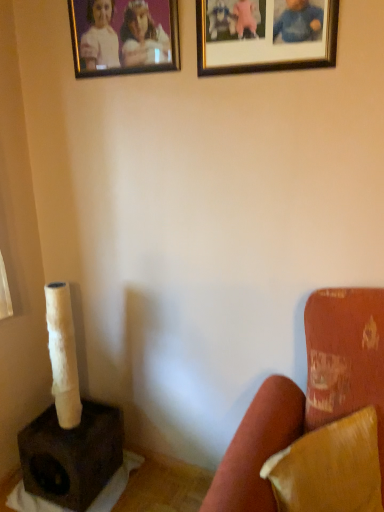
Question: Is dark brown matte speaker at lower left in contact with gold-framed picture at upper center, the 2th picture frame when ordered from left to right?

Choices:
 (A) no
 (B) yes

Answer: (A)

Question: Is dark brown matte speaker at lower left smaller than gold-framed picture at upper center, acting as the first picture frame starting from the right?

Choices:
 (A) no
 (B) yes

Answer: (A)

Question: From a real-world perspective, is dark brown matte speaker at lower left positioned over gold-framed picture at upper center, acting as the first picture frame starting from the right, based on gravity?

Choices:
 (A) yes
 (B) no

Answer: (B)

Question: From a real-world perspective, is dark brown matte speaker at lower left under gold-framed picture at upper center, the 2th picture frame when ordered from left to right?

Choices:
 (A) no
 (B) yes

Answer: (B)

Question: Is gold-framed picture at upper center, acting as the first picture frame starting from the right, located within dark brown matte speaker at lower left?

Choices:
 (A) yes
 (B) no

Answer: (B)

Question: Relative to gold-framed picture at upper center, the 2th picture frame when ordered from left to right, is gold-framed photo at upper center, which ranks as the first picture frame in left-to-right order, in front or behind?

Choices:
 (A) front
 (B) behind

Answer: (B)

Question: Considering the positions of point (137, 70) and point (249, 49), is point (137, 70) closer or farther from the camera than point (249, 49)?

Choices:
 (A) farther
 (B) closer

Answer: (A)

Question: Considering the positions of gold-framed photo at upper center, which ranks as the first picture frame in left-to-right order, and gold-framed picture at upper center, the 2th picture frame when ordered from left to right, in the image, is gold-framed photo at upper center, which ranks as the first picture frame in left-to-right order, bigger or smaller than gold-framed picture at upper center, the 2th picture frame when ordered from left to right,?

Choices:
 (A) small
 (B) big

Answer: (B)

Question: From the image's perspective, is gold-framed photo at upper center, which ranks as the first picture frame in left-to-right order, above or below gold-framed picture at upper center, acting as the first picture frame starting from the right?

Choices:
 (A) above
 (B) below

Answer: (A)

Question: Is gold-framed picture at upper center, acting as the first picture frame starting from the right, in front of or behind gold-framed photo at upper center, the second picture frame in the right-to-left sequence, in the image?

Choices:
 (A) behind
 (B) front

Answer: (B)

Question: Considering the positions of point (258, 23) and point (129, 42), is point (258, 23) closer or farther from the camera than point (129, 42)?

Choices:
 (A) farther
 (B) closer

Answer: (B)

Question: Would you say gold-framed picture at upper center, the 2th picture frame when ordered from left to right, is inside or outside gold-framed photo at upper center, the second picture frame in the right-to-left sequence?

Choices:
 (A) outside
 (B) inside

Answer: (A)

Question: Is gold-framed picture at upper center, the 2th picture frame when ordered from left to right, wider or thinner than gold-framed photo at upper center, the second picture frame in the right-to-left sequence?

Choices:
 (A) wide
 (B) thin

Answer: (B)

Question: Is gold-framed photo at upper center, the second picture frame in the right-to-left sequence, in front of or behind velvet red armchair at lower right in the image?

Choices:
 (A) front
 (B) behind

Answer: (B)

Question: Considering the positions of gold-framed photo at upper center, the second picture frame in the right-to-left sequence, and velvet red armchair at lower right in the image, is gold-framed photo at upper center, the second picture frame in the right-to-left sequence, wider or thinner than velvet red armchair at lower right?

Choices:
 (A) wide
 (B) thin

Answer: (B)